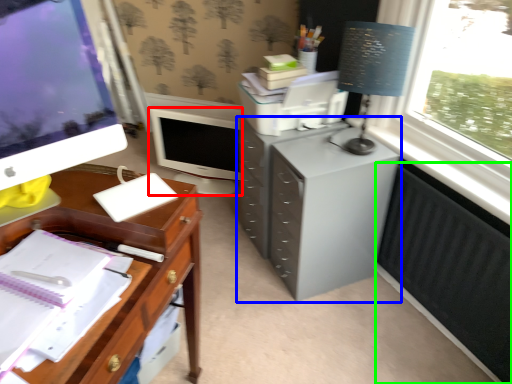
Question: Which is farther away from computer monitor (highlighted by a red box)? filing cabinet (highlighted by a blue box) or radiator (highlighted by a green box)?

Choices:
 (A) filing cabinet
 (B) radiator

Answer: (B)